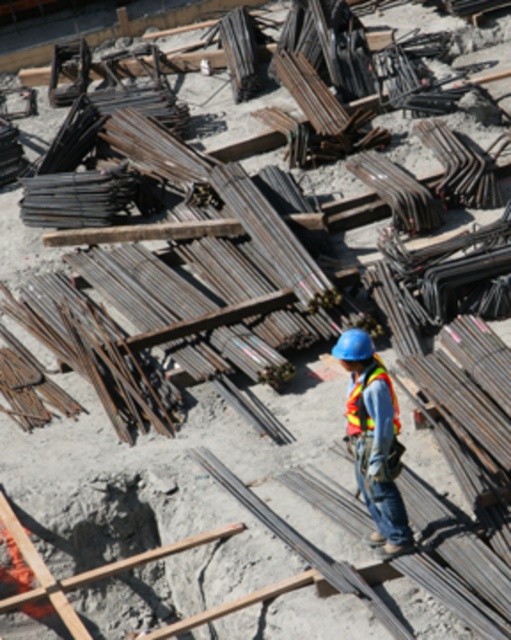
You are a construction worker standing at point A, which is at the location of point (x=354, y=340). You need to move to point B, located at point (x=385, y=490). Based on the scene description, in which direction should you walk to reach point B?

To reach point B at (x=385, y=490) from point A at (x=354, y=340), you should walk forward since point B is behind point A according to the spatial arrangement described.

You are a delivery driver who needs to drop off a package at the construction site. The package must be placed near the reflective fabric safety vest at center. According to the coordinates provided, where exactly should you position the package?

The reflective fabric safety vest at center is located at point (363, 403), so you should position the package near those coordinates to ensure it is placed correctly.